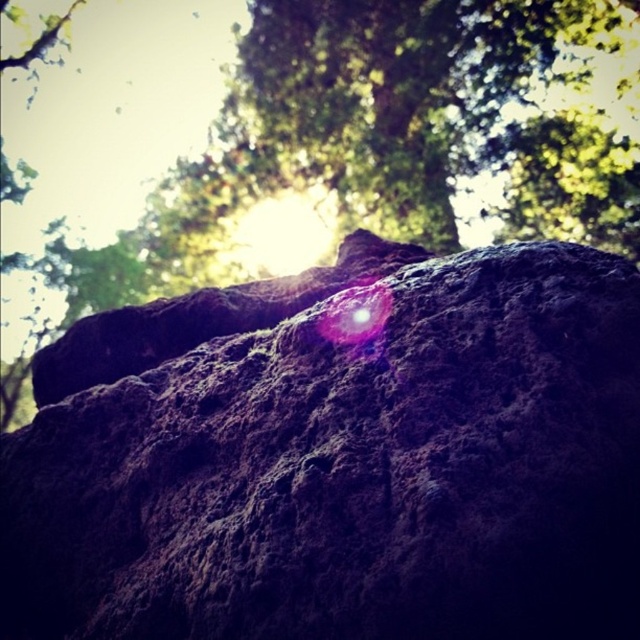
Question: Is dark brown rough rock at center to the right of green rough bark at upper center from the viewer's perspective?

Choices:
 (A) no
 (B) yes

Answer: (B)

Question: In this image, where is dark brown rough rock at center located relative to green rough bark at upper center?

Choices:
 (A) right
 (B) left

Answer: (A)

Question: Which point is farther to the camera?

Choices:
 (A) (538, 38)
 (B) (333, 273)

Answer: (A)

Question: Is dark brown rough rock at center smaller than green rough bark at upper center?

Choices:
 (A) no
 (B) yes

Answer: (B)

Question: Which point appears farthest from the camera in this image?

Choices:
 (A) (625, 612)
 (B) (288, 45)

Answer: (B)